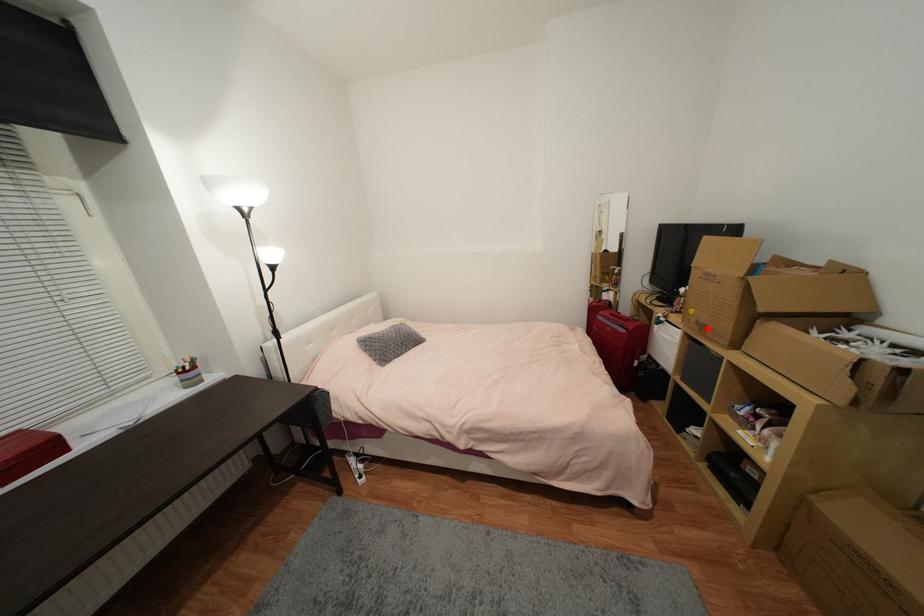
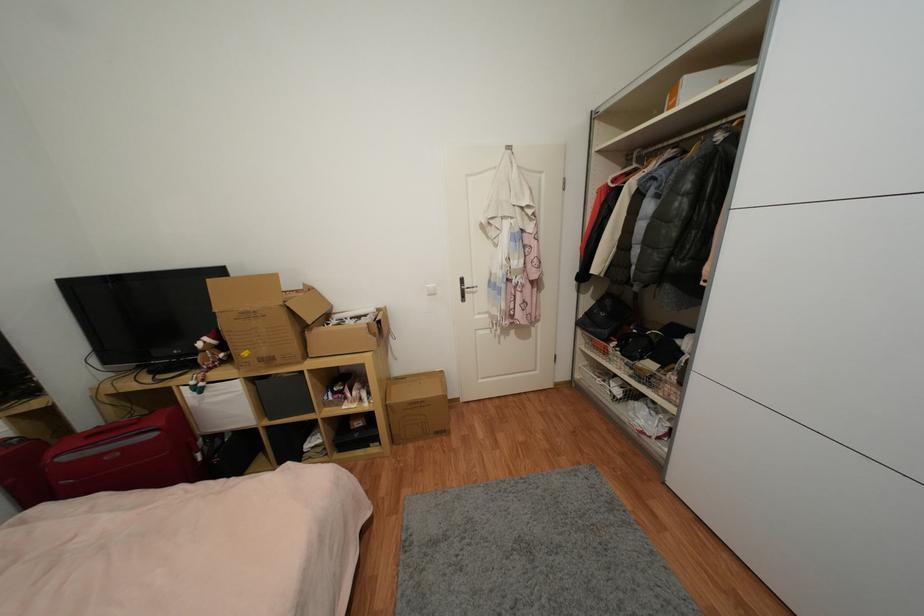
Find the pixel in the second image that matches the highlighted location in the first image.

(274, 361)